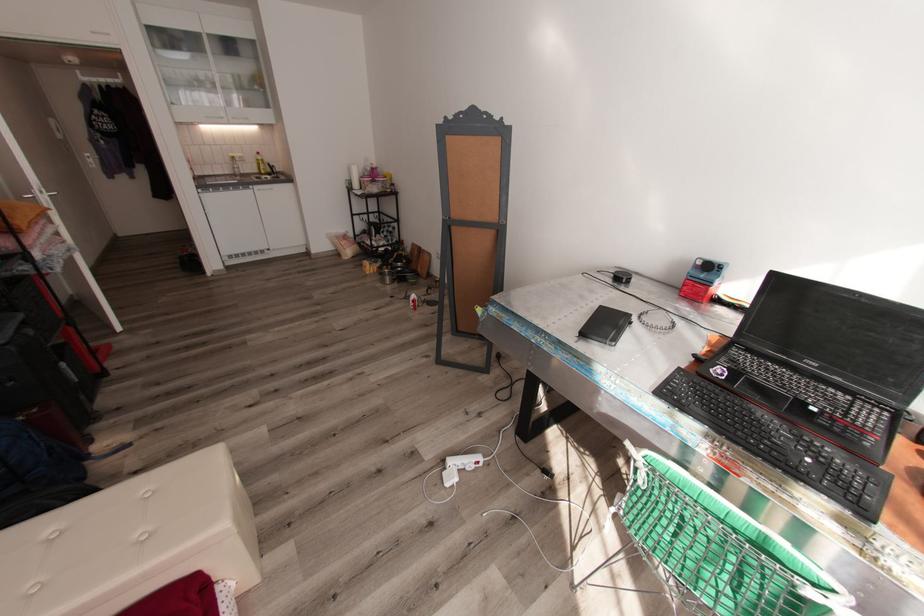
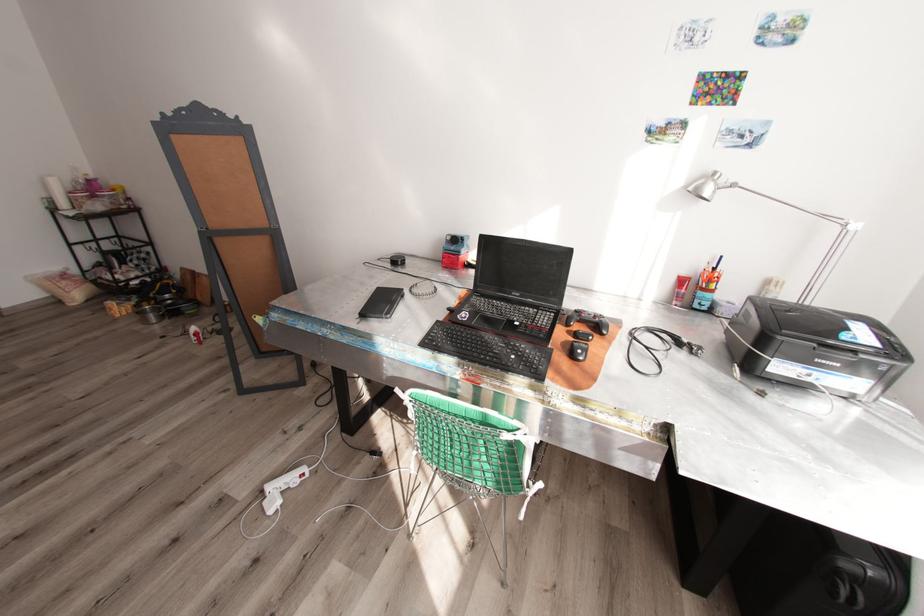
The point at (811, 439) is marked in the first image. Where is the corresponding point in the second image?

(517, 344)